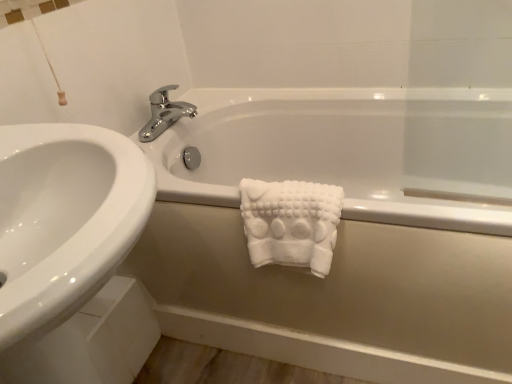
Locate an element on the screen. The height and width of the screenshot is (384, 512). white fluffy towel at center is located at coordinates click(x=291, y=223).

Find the location of a particular element. This screenshot has height=384, width=512. chrome/metallic faucet at upper center is located at coordinates 164,113.

Locate an element on the screen. white glossy sink at upper left is located at coordinates (64, 219).

In order to click on white matte bathtub at center in this screenshot , I will do `click(343, 230)`.

From a real-world perspective, is chrome/metallic faucet at upper center beneath white matte bathtub at center?

Incorrect, from a real-world perspective, chrome/metallic faucet at upper center is higher than white matte bathtub at center.

Considering the sizes of chrome/metallic faucet at upper center and white matte bathtub at center in the image, is chrome/metallic faucet at upper center wider or thinner than white matte bathtub at center?

chrome/metallic faucet at upper center is thinner than white matte bathtub at center.

In the scene shown: Are chrome/metallic faucet at upper center and white matte bathtub at center far apart?

chrome/metallic faucet at upper center is actually quite close to white matte bathtub at center.

Between chrome/metallic faucet at upper center and white matte bathtub at center, which one has more height?

Standing taller between the two is white matte bathtub at center.

Is white glossy sink at upper left in front of or behind white matte bathtub at center in the image?

white glossy sink at upper left is in front of white matte bathtub at center.

Is white glossy sink at upper left facing away from white matte bathtub at center?

No.

Are white glossy sink at upper left and white matte bathtub at center far apart?

That's not correct — white glossy sink at upper left is a little close to white matte bathtub at center.

What are the coordinates of `bathtub located underneath the white glossy sink at upper left (from a real-world perspective)` in the screenshot? It's located at (343, 230).

Considering the relative positions of white matte bathtub at center and white fluffy towel at center in the image provided, is white matte bathtub at center to the left of white fluffy towel at center from the viewer's perspective?

In fact, white matte bathtub at center is to the right of white fluffy towel at center.

Is white matte bathtub at center far away from white fluffy towel at center?

No, white matte bathtub at center is not far away from white fluffy towel at center.

Where is `bath towel above the white matte bathtub at center (from a real-world perspective)`? bath towel above the white matte bathtub at center (from a real-world perspective) is located at coordinates (291, 223).

From the image's perspective, which one is positioned higher, white matte bathtub at center or white fluffy towel at center?

white matte bathtub at center.

Which is more distant, (179, 269) or (58, 211)?

Point (179, 269)

Is white matte bathtub at center taller than white glossy sink at upper left?

No, white matte bathtub at center is not taller than white glossy sink at upper left.

Who is smaller, white matte bathtub at center or white glossy sink at upper left?

With smaller size is white glossy sink at upper left.

Is white fluffy towel at center located outside white matte bathtub at center?

No, white fluffy towel at center is not entirely external to white matte bathtub at center.

Considering the sizes of white fluffy towel at center and white matte bathtub at center in the image, is white fluffy towel at center taller or shorter than white matte bathtub at center?

white fluffy towel at center is shorter than white matte bathtub at center.

Is white fluffy towel at center oriented away from white matte bathtub at center?

Yes, white fluffy towel at center is facing away from white matte bathtub at center.

Which of these two, white fluffy towel at center or chrome/metallic faucet at upper center, is smaller?

With smaller size is chrome/metallic faucet at upper center.

Consider the image. Between white fluffy towel at center and chrome/metallic faucet at upper center, which one has smaller width?

white fluffy towel at center.

From a real-world perspective, is white fluffy towel at center above or below chrome/metallic faucet at upper center?

In terms of real-world spatial position, white fluffy towel at center is below chrome/metallic faucet at upper center.

In the scene shown: Is white fluffy towel at center located outside chrome/metallic faucet at upper center?

Yes, white fluffy towel at center is outside of chrome/metallic faucet at upper center.

Does white fluffy towel at center lie behind white glossy sink at upper left?

Yes, it is.

Does white fluffy towel at center have a lesser width compared to white glossy sink at upper left?

Indeed, white fluffy towel at center has a lesser width compared to white glossy sink at upper left.

Considering the relative sizes of white fluffy towel at center and white glossy sink at upper left in the image provided, is white fluffy towel at center shorter than white glossy sink at upper left?

Yes, white fluffy towel at center is shorter than white glossy sink at upper left.

Are white fluffy towel at center and white glossy sink at upper left far apart?

white fluffy towel at center is actually quite close to white glossy sink at upper left.

Locate an element on the screen. Image resolution: width=512 pixels, height=384 pixels. tap located on the left of white matte bathtub at center is located at coordinates (164, 113).

The width and height of the screenshot is (512, 384). In order to click on bathtub above the white glossy sink at upper left (from the image's perspective) in this screenshot , I will do `click(343, 230)`.

From the image, which object appears to be farther from white fluffy towel at center, white glossy sink at upper left or chrome/metallic faucet at upper center?

Among the two, chrome/metallic faucet at upper center is located further to white fluffy towel at center.

Looking at the image, which one is located further to chrome/metallic faucet at upper center, white fluffy towel at center or white glossy sink at upper left?

Among the two, white glossy sink at upper left is located further to chrome/metallic faucet at upper center.

Looking at the image, which one is located closer to white fluffy towel at center, white matte bathtub at center or white glossy sink at upper left?

Based on the image, white matte bathtub at center appears to be nearer to white fluffy towel at center.

Based on their spatial positions, is white fluffy towel at center or white glossy sink at upper left further from white matte bathtub at center?

white glossy sink at upper left is further to white matte bathtub at center.

Which object lies further to the anchor point white matte bathtub at center, chrome/metallic faucet at upper center or white glossy sink at upper left?

white glossy sink at upper left lies further to white matte bathtub at center than the other object.

Based on the photo, looking at the image, which one is located closer to chrome/metallic faucet at upper center, white fluffy towel at center or white matte bathtub at center?

white matte bathtub at center is positioned closer to the anchor chrome/metallic faucet at upper center.

Based on their spatial positions, is white glossy sink at upper left or white fluffy towel at center further from white matte bathtub at center?

white glossy sink at upper left lies further to white matte bathtub at center than the other object.

From the image, which object appears to be nearer to white glossy sink at upper left, chrome/metallic faucet at upper center or white fluffy towel at center?

white fluffy towel at center is closer to white glossy sink at upper left.

Locate an element on the screen. The height and width of the screenshot is (384, 512). bath towel between white matte bathtub at center and chrome/metallic faucet at upper center from front to back is located at coordinates (291, 223).

Where is `bathtub between white glossy sink at upper left and chrome/metallic faucet at upper center from front to back`? The width and height of the screenshot is (512, 384). bathtub between white glossy sink at upper left and chrome/metallic faucet at upper center from front to back is located at coordinates (343, 230).

You are a GUI agent. You are given a task and a screenshot of the screen. Output one action in this format:
    pyautogui.click(x=<x>, y=<y>)
    Task: Click on the bath towel between white glossy sink at upper left and chrome/metallic faucet at upper center along the z-axis
    
    Given the screenshot: What is the action you would take?
    pyautogui.click(x=291, y=223)

Locate an element on the screen. The image size is (512, 384). bath towel between white glossy sink at upper left and white matte bathtub at center in the horizontal direction is located at coordinates (291, 223).